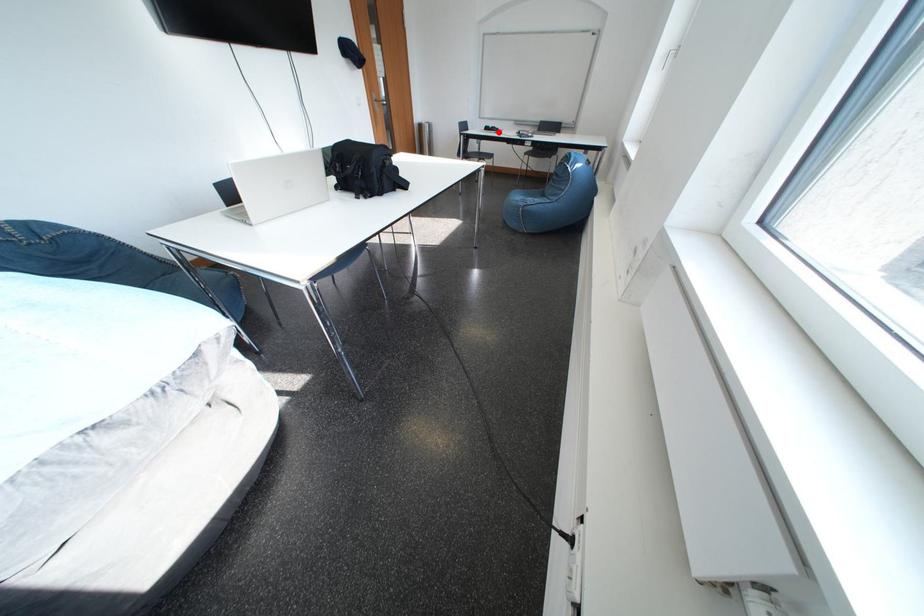
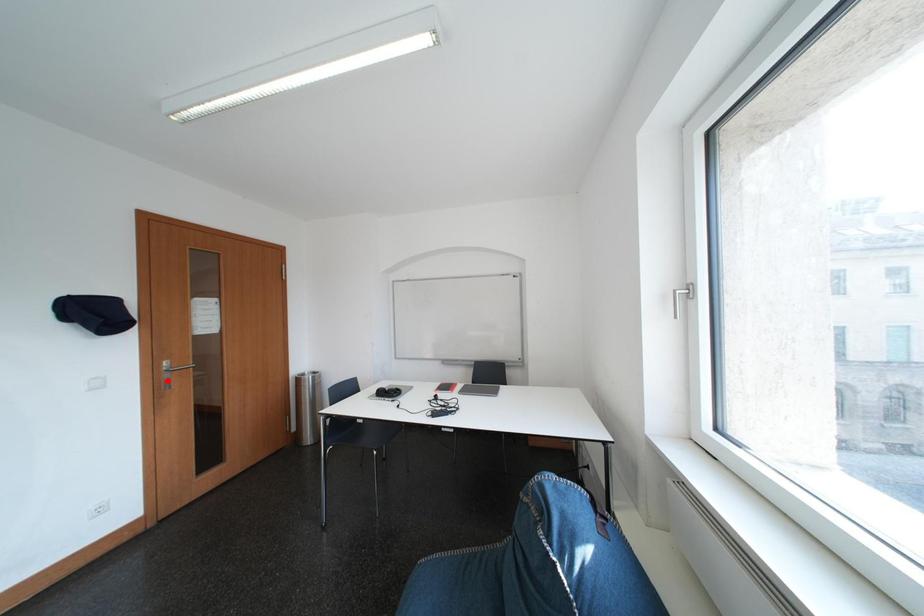
I am providing you with two images of the same scene from different viewpoints. A red point is marked on the first image and another point is marked on the second image. Is the marked point in image1 the same physical position as the marked point in image2?

No